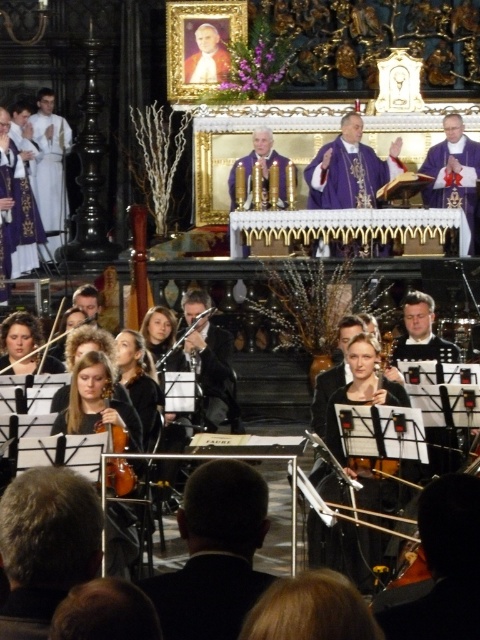
Question: Among these points, which one is farthest from the camera?

Choices:
 (A) (328, 147)
 (B) (226, 563)
 (C) (103, 396)

Answer: (A)

Question: Is white silk robe at left thinner than purple velvet robe at upper right?

Choices:
 (A) yes
 (B) no

Answer: (A)

Question: Which point is closer to the camera?

Choices:
 (A) purple satin robe at upper center
 (B) white silk robe at left
 (C) purple velvet robe at upper right
 (D) matte brown violin at lower left

Answer: (D)

Question: Which point is closer to the camera taking this photo?

Choices:
 (A) (109, 458)
 (B) (396, 157)

Answer: (A)

Question: Can you confirm if white silk robe at left is wider than purple velvet robe at upper right?

Choices:
 (A) yes
 (B) no

Answer: (B)

Question: From the image, what is the correct spatial relationship of purple satin robe at upper center in relation to purple velvet robe at left?

Choices:
 (A) right
 (B) left

Answer: (A)